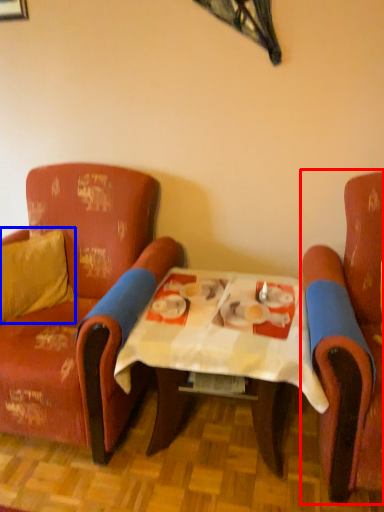
Question: Which point is further to the camera, chair (highlighted by a red box) or pillow (highlighted by a blue box)?

Choices:
 (A) chair
 (B) pillow

Answer: (B)